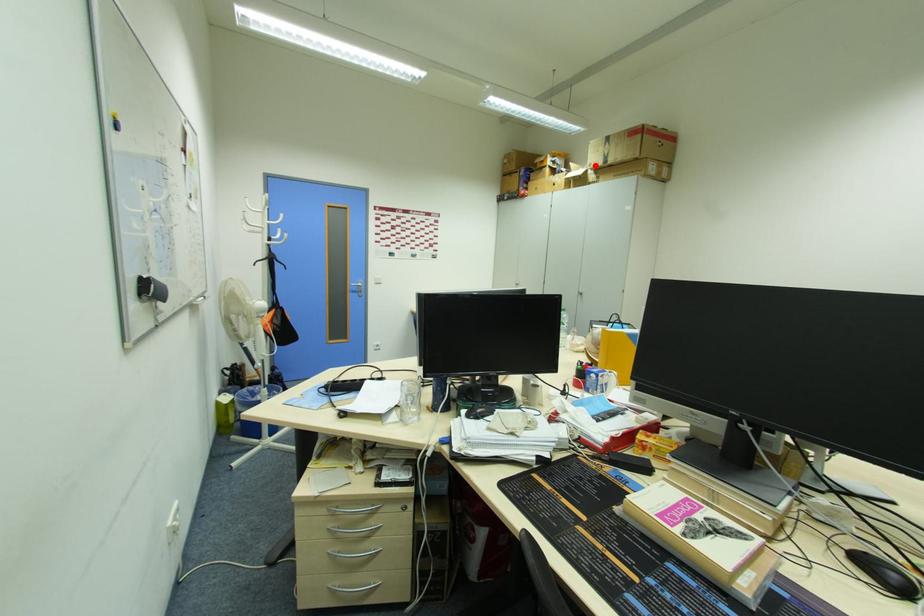
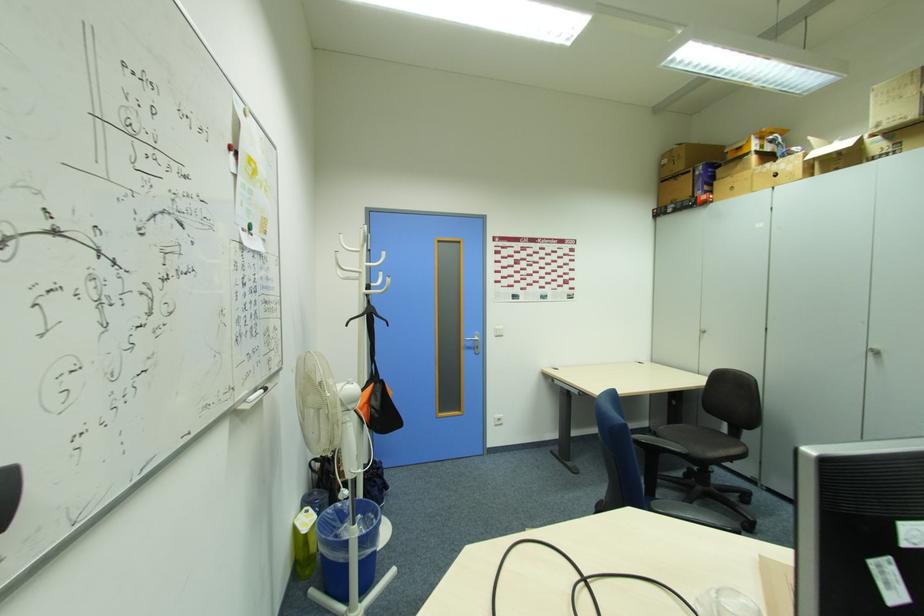
Where in the second image is the point corresponding to the highlighted location from the first image?

(889, 123)